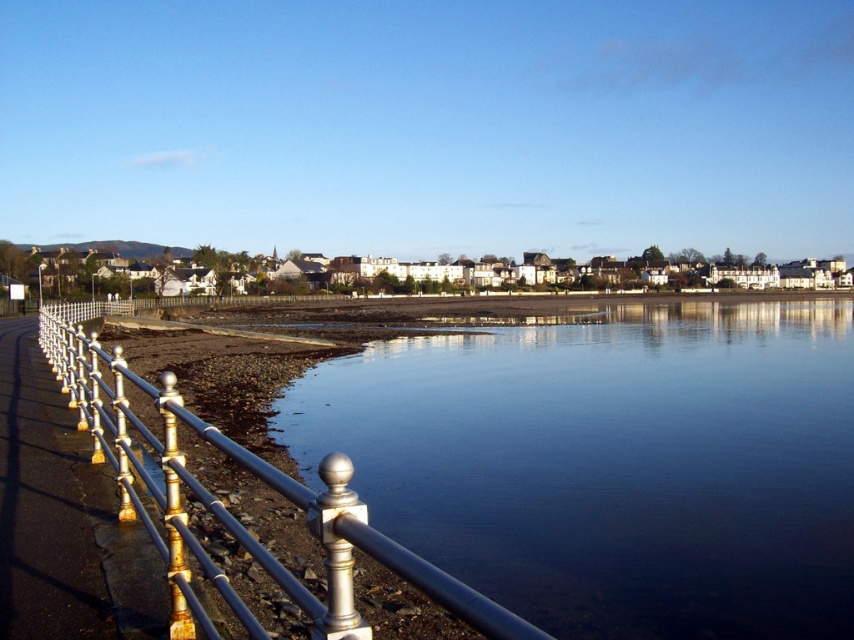
You are a photographer planning to capture the coastal scene. You want to ensure that the clear glass water at center and the metallic rail at left are both visible in your shot. Based on their sizes, which object should you prioritize framing closer to the edge of the frame to avoid overcrowding?

The metallic rail at left should be prioritized closer to the edge of the frame since its width is smaller than the clear glass water at center, which is wider and requires more space in the composition.

You are standing at the point marked by the coordinates point (229, 509) in the coastal scene. What object is located at this position?

The point (229, 509) indicates the silver golden metal fence at left.